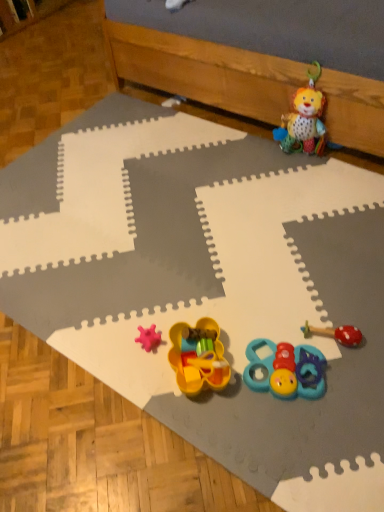
The height and width of the screenshot is (512, 384). Find the location of `vacant region in front of yellow plastic toy at center, which appears as the 3th toy when viewed from the top`. vacant region in front of yellow plastic toy at center, which appears as the 3th toy when viewed from the top is located at coordinates (240, 443).